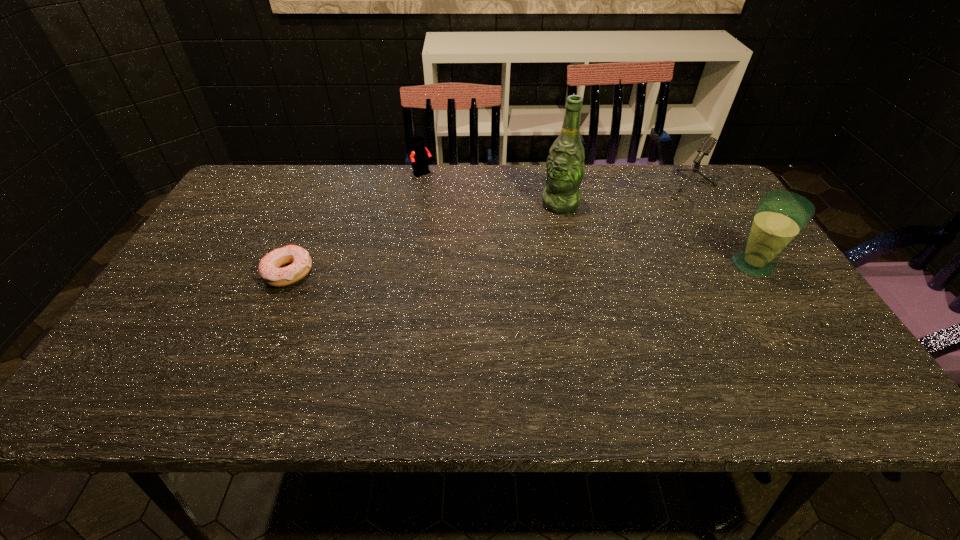
At what (x,y) coordinates should I click in order to perform the action: click on free space located on the front-facing side of the second object from left to right. Please return your answer as a coordinate pair (x, y). This screenshot has height=540, width=960. Looking at the image, I should click on 441,195.

Find the location of a particular element. vacant area located 0.260m on the front-facing side of the second object from left to right is located at coordinates (466, 226).

The height and width of the screenshot is (540, 960). In order to click on vacant region located 0.130m on the stand of the microphone in this screenshot , I will do `click(636, 226)`.

Image resolution: width=960 pixels, height=540 pixels. In order to click on vacant space situated 0.290m on the stand of the microphone in this screenshot , I will do `click(604, 253)`.

The image size is (960, 540). Find the location of `vacant region located on the stand of the microphone`. vacant region located on the stand of the microphone is located at coordinates (583, 269).

Find the location of a particular element. vacant space located on the surface of the tallest object is located at coordinates (485, 282).

You are a GUI agent. You are given a task and a screenshot of the screen. Output one action in this format:
    pyautogui.click(x=<x>, y=<y>)
    Task: Click on the vacant space located on the surface of the tallest object
    
    Given the screenshot: What is the action you would take?
    pyautogui.click(x=534, y=231)

You are a GUI agent. You are given a task and a screenshot of the screen. Output one action in this format:
    pyautogui.click(x=<x>, y=<y>)
    Task: Click on the vacant area situated 0.050m on the surface of the tallest object
    The image size is (960, 540).
    Given the screenshot: What is the action you would take?
    pyautogui.click(x=542, y=222)

Where is `Lego present at the far edge`? Lego present at the far edge is located at coordinates (420, 155).

Locate an element on the screen. microphone that is positioned at the far edge is located at coordinates (706, 147).